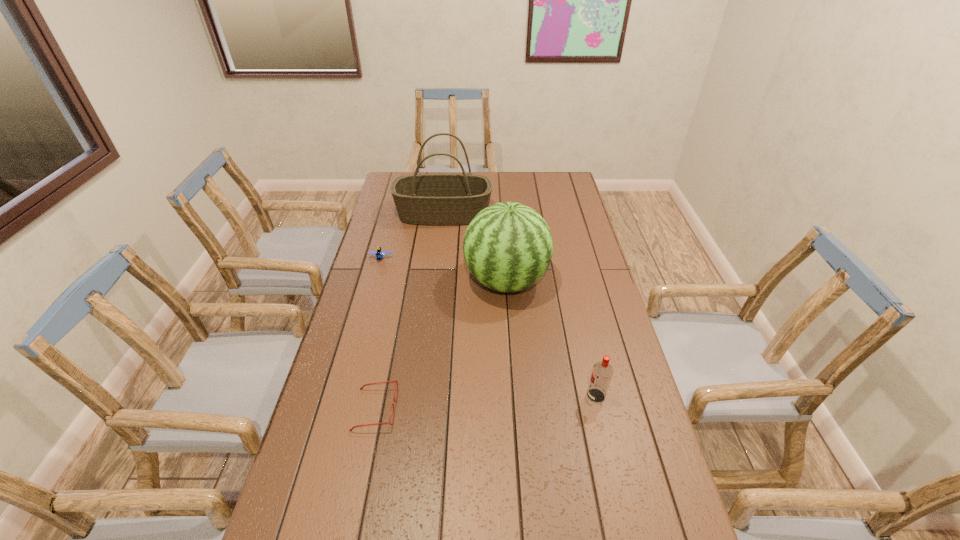
Find the location of a particular element. This screenshot has height=540, width=960. free space at the far left corner of the desktop is located at coordinates (389, 179).

I want to click on vacant space at the far right corner of the desktop, so click(555, 181).

You are a GUI agent. You are given a task and a screenshot of the screen. Output one action in this format:
    pyautogui.click(x=<x>, y=<y>)
    Task: Click on the free space that is in between the farthest object and the vodka
    Image resolution: width=960 pixels, height=540 pixels.
    Given the screenshot: What is the action you would take?
    pyautogui.click(x=519, y=305)

Where is `free space that is in between the Lego and the watermelon`? The height and width of the screenshot is (540, 960). free space that is in between the Lego and the watermelon is located at coordinates (444, 269).

Find the location of a particular element. This screenshot has width=960, height=540. free space between the spectacles and the farthest object is located at coordinates (409, 312).

This screenshot has height=540, width=960. What are the coordinates of `free spot between the basket and the Lego` in the screenshot? It's located at coord(412,236).

Where is `unoccupied area between the farthest object and the Lego`? The image size is (960, 540). unoccupied area between the farthest object and the Lego is located at coordinates (412, 236).

Where is `vacant space that is in between the watermelon and the spectacles`? The width and height of the screenshot is (960, 540). vacant space that is in between the watermelon and the spectacles is located at coordinates (441, 345).

Locate an element on the screen. free point between the watermelon and the third shortest object is located at coordinates (551, 339).

Identify the location of free spot between the farthest object and the spectacles. The width and height of the screenshot is (960, 540). (409, 312).